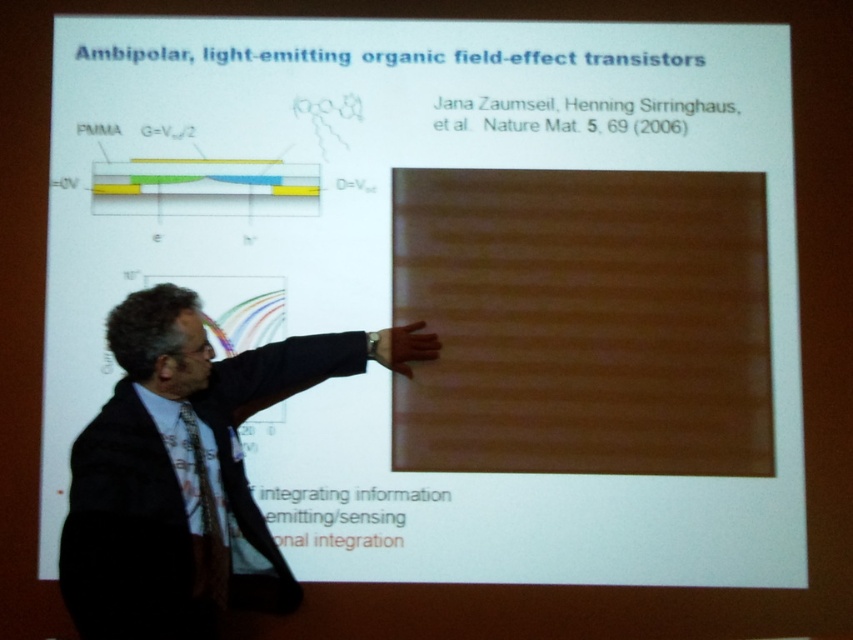
Who is more distant from viewer, (135,593) or (210,580)?

Point (210,580)

Measure the distance from dark suit at center to black textured tie at center.

dark suit at center is 5.46 inches away from black textured tie at center.

Who is more distant from viewer, [270,588] or [183,408]?

Point [270,588]

Locate an element on the screen. dark suit at center is located at coordinates (189, 470).